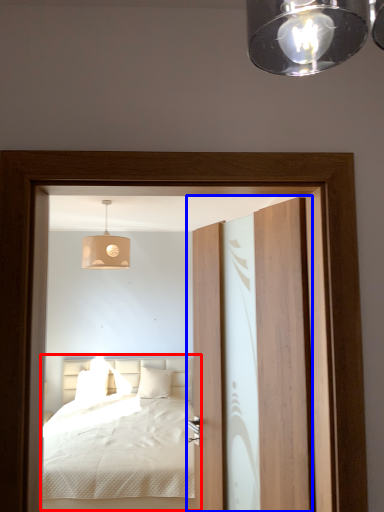
Question: Which point is closer to the camera, bed (highlighted by a red box) or door (highlighted by a blue box)?

Choices:
 (A) bed
 (B) door

Answer: (B)